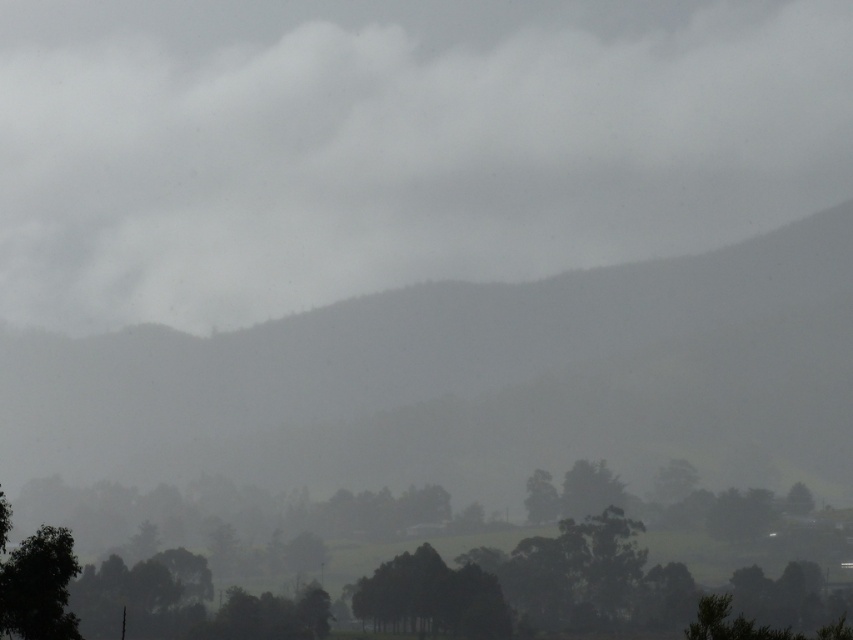
The width and height of the screenshot is (853, 640). What are the coordinates of `green matte tree at lower center` in the screenshot? It's located at (531, 584).

Who is higher up, green matte tree at lower center or green matte tree at lower right?

green matte tree at lower right is higher up.

I want to click on green matte tree at lower center, so click(x=531, y=584).

Can you confirm if green matte tree at lower center is thinner than green matte tree at center?

In fact, green matte tree at lower center might be wider than green matte tree at center.

Is green matte tree at lower center positioned in front of green matte tree at center?

Yes, green matte tree at lower center is in front of green matte tree at center.

Locate an element on the screen. The image size is (853, 640). green matte tree at lower center is located at coordinates (531, 584).

The image size is (853, 640). What are the coordinates of `green matte tree at lower center` in the screenshot? It's located at (531, 584).

Who is lower down, green leafy tree at lower left or green matte tree at lower right?

green matte tree at lower right is lower down.

You are a GUI agent. You are given a task and a screenshot of the screen. Output one action in this format:
    pyautogui.click(x=<x>, y=<y>)
    Task: Click on the green leafy tree at lower left
    The width and height of the screenshot is (853, 640).
    Given the screenshot: What is the action you would take?
    pyautogui.click(x=38, y=586)